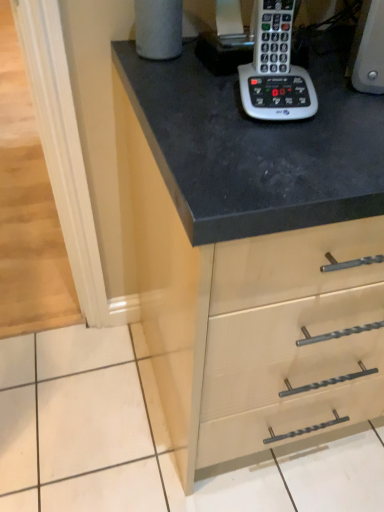
Image resolution: width=384 pixels, height=512 pixels. Find the location of `white plastic telephone at upper right`. white plastic telephone at upper right is located at coordinates (275, 69).

Describe the element at coordinates (275, 69) in the screenshot. I see `white plastic telephone at upper right` at that location.

Locate an element on the screen. white plastic telephone at upper right is located at coordinates point(275,69).